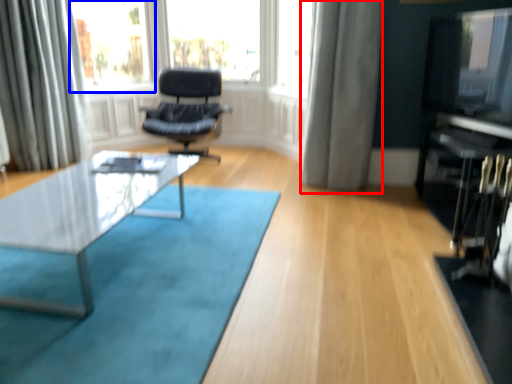
Question: Which point is further to the camera, curtain (highlighted by a red box) or bay window (highlighted by a blue box)?

Choices:
 (A) curtain
 (B) bay window

Answer: (B)